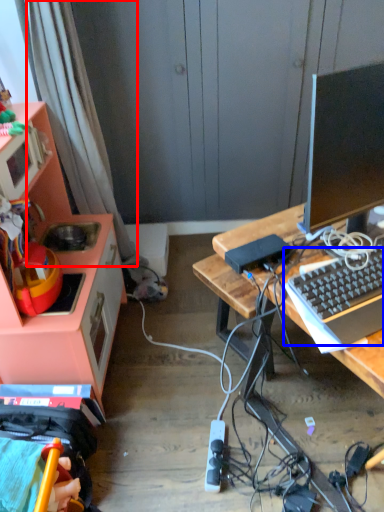
Question: Which of the following is the farthest to the observer, curtain (highlighted by a red box) or computer keyboard (highlighted by a blue box)?

Choices:
 (A) curtain
 (B) computer keyboard

Answer: (A)